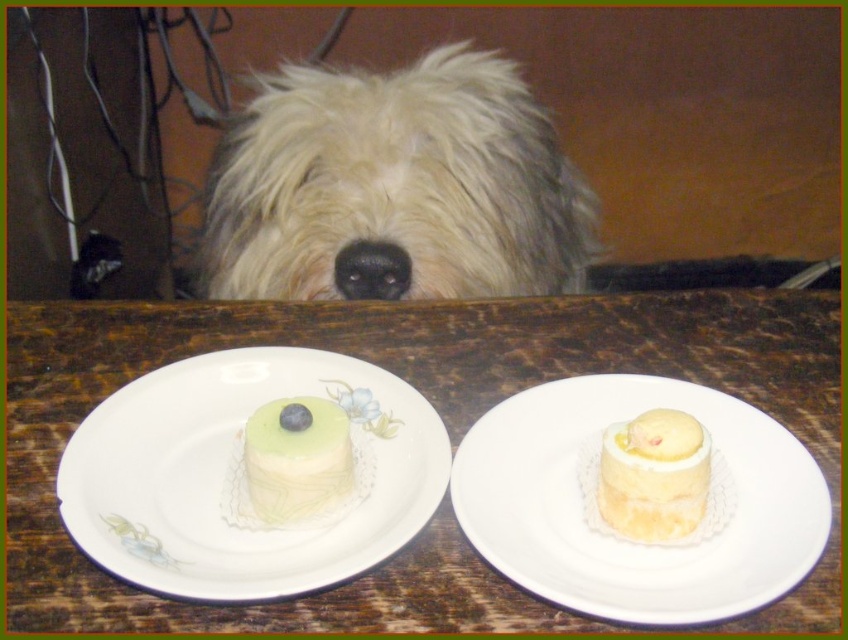
Does white fluffy dog at upper center have a lesser width compared to white porcelain plate at center?

In fact, white fluffy dog at upper center might be wider than white porcelain plate at center.

Looking at this image, does white fluffy dog at upper center come in front of white porcelain plate at center?

No, white fluffy dog at upper center is further to the viewer.

The height and width of the screenshot is (640, 848). Identify the location of white fluffy dog at upper center. (395, 182).

Who is positioned more to the left, white ceramic plates at center or white ceramic plate at center?

Positioned to the left is white ceramic plates at center.

Can you confirm if white ceramic plates at center is thinner than white ceramic plate at center?

Incorrect, white ceramic plates at center's width is not less than white ceramic plate at center's.

Is point (494, 355) more distant than point (756, 410)?

That is True.

Find the location of `white ceramic plates at center`. white ceramic plates at center is located at coordinates (441, 419).

Can you confirm if yellow frosted cake at right is wider than green matte cake at center?

No.

Who is positioned more to the left, yellow frosted cake at right or green matte cake at center?

Positioned to the left is green matte cake at center.

Measure the distance between yellow frosted cake at right and camera.

A distance of 16.30 inches exists between yellow frosted cake at right and camera.

The image size is (848, 640). In order to click on yellow frosted cake at right in this screenshot , I will do `click(654, 476)`.